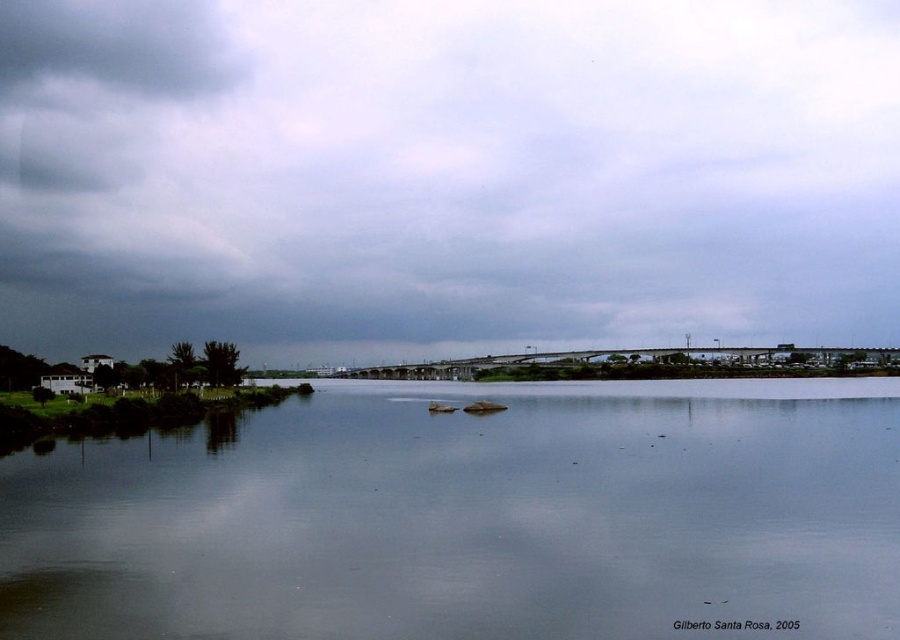
Question: Estimate the real-world distances between objects in this image. Which object is farther from the smooth water at center?

Choices:
 (A) cloudy sky at upper center
 (B) dark gray cloud at upper left

Answer: (B)

Question: Can you confirm if smooth water at center is smaller than dark gray cloud at upper left?

Choices:
 (A) yes
 (B) no

Answer: (A)

Question: Does smooth water at center have a smaller size compared to dark gray cloud at upper left?

Choices:
 (A) no
 (B) yes

Answer: (B)

Question: Is smooth water at center bigger than dark gray cloud at upper left?

Choices:
 (A) yes
 (B) no

Answer: (B)

Question: Which of the following is the closest to the observer?

Choices:
 (A) cloudy sky at upper center
 (B) dark gray cloud at upper left

Answer: (A)

Question: Which point appears closest to the camera in this image?

Choices:
 (A) (482, 163)
 (B) (128, 74)

Answer: (A)